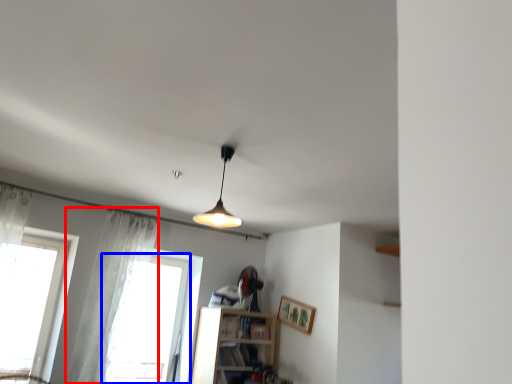
Question: Which object is further to the camera taking this photo, curtain (highlighted by a red box) or window (highlighted by a blue box)?

Choices:
 (A) curtain
 (B) window

Answer: (B)